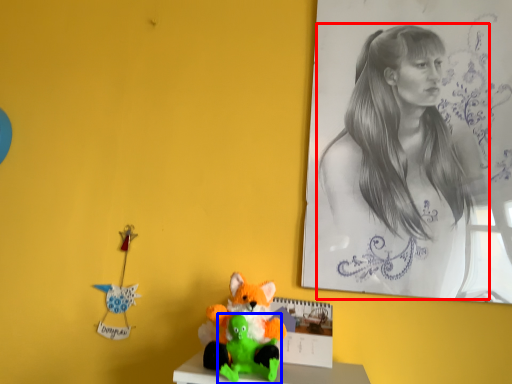
Question: Among these objects, which one is nearest to the camera, woman (highlighted by a red box) or toy (highlighted by a blue box)?

Choices:
 (A) woman
 (B) toy

Answer: (B)